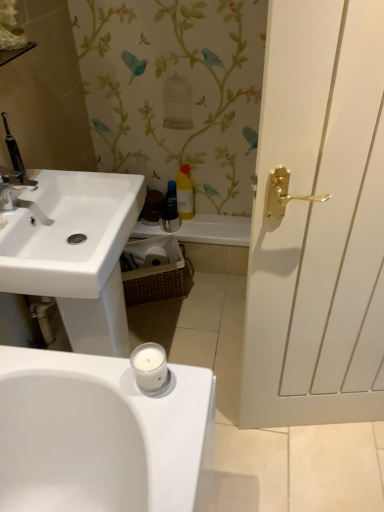
Question: Which direction should I rotate to look at translucent plastic bottle at center, which ranks as the 1th toiletry in left-to-right order?

Choices:
 (A) right
 (B) left

Answer: (B)

Question: Can you confirm if translucent plastic bottle at center, which ranks as the 1th toiletry in left-to-right order, is taller than yellow matte bottle at center, marked as the second toiletry in a left-to-right arrangement?

Choices:
 (A) yes
 (B) no

Answer: (B)

Question: Would you say yellow matte bottle at center, the first toiletry in the right-to-left sequence, is part of translucent plastic bottle at center, the 2th toiletry in the right-to-left sequence,'s contents?

Choices:
 (A) yes
 (B) no

Answer: (B)

Question: Is the depth of translucent plastic bottle at center, which ranks as the 1th toiletry in left-to-right order, greater than that of yellow matte bottle at center, marked as the second toiletry in a left-to-right arrangement?

Choices:
 (A) no
 (B) yes

Answer: (B)

Question: Is translucent plastic bottle at center, the 2th toiletry in the right-to-left sequence, thinner than yellow matte bottle at center, marked as the second toiletry in a left-to-right arrangement?

Choices:
 (A) yes
 (B) no

Answer: (A)

Question: Does translucent plastic bottle at center, which ranks as the 1th toiletry in left-to-right order, lie in front of yellow matte bottle at center, the first toiletry in the right-to-left sequence?

Choices:
 (A) no
 (B) yes

Answer: (A)

Question: Is translucent plastic bottle at center, the 2th toiletry in the right-to-left sequence, wider than yellow matte bottle at center, marked as the second toiletry in a left-to-right arrangement?

Choices:
 (A) no
 (B) yes

Answer: (A)

Question: Can you confirm if yellow matte bottle at center, the first toiletry in the right-to-left sequence, is bigger than white wood door at right?

Choices:
 (A) yes
 (B) no

Answer: (B)

Question: Is yellow matte bottle at center, the first toiletry in the right-to-left sequence, next to white wood door at right?

Choices:
 (A) no
 (B) yes

Answer: (A)

Question: Does yellow matte bottle at center, marked as the second toiletry in a left-to-right arrangement, have a lesser width compared to white wood door at right?

Choices:
 (A) no
 (B) yes

Answer: (B)

Question: Would you say yellow matte bottle at center, the first toiletry in the right-to-left sequence, is outside white wood door at right?

Choices:
 (A) yes
 (B) no

Answer: (A)

Question: From the image's perspective, is yellow matte bottle at center, marked as the second toiletry in a left-to-right arrangement, on white wood door at right?

Choices:
 (A) yes
 (B) no

Answer: (A)

Question: Can you confirm if yellow matte bottle at center, marked as the second toiletry in a left-to-right arrangement, is positioned to the left of white wood door at right?

Choices:
 (A) yes
 (B) no

Answer: (A)

Question: Is matte silver faucet at upper left wider than brown woven basket at center?

Choices:
 (A) yes
 (B) no

Answer: (B)